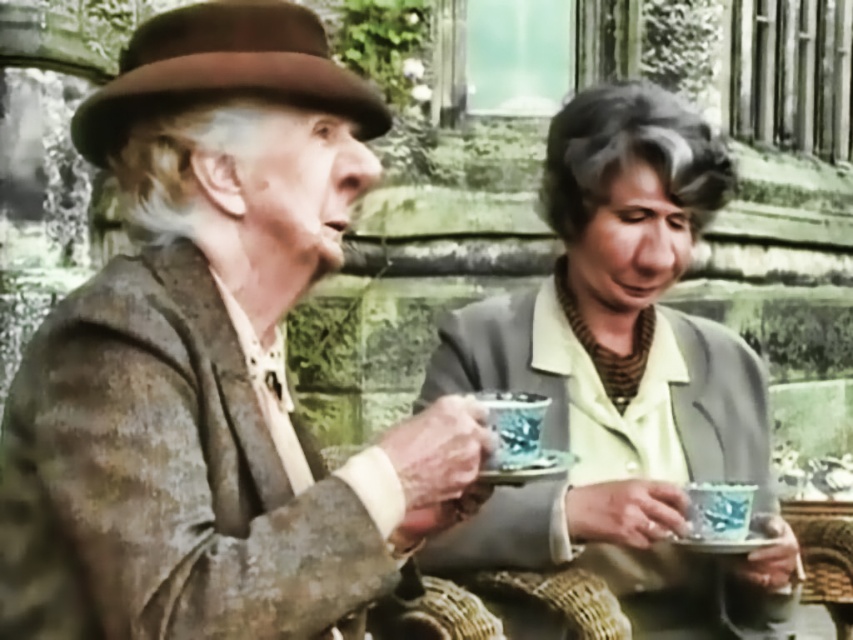
Question: Does distressed brown leather jacket at left appear on the right side of porcelain blue saucer at lower center?

Choices:
 (A) no
 (B) yes

Answer: (A)

Question: Is the position of distressed brown leather jacket at left less distant than that of matte blue teacup at center?

Choices:
 (A) no
 (B) yes

Answer: (B)

Question: Which of these objects is positioned closest to the porcelain blue saucer at lower center?

Choices:
 (A) matte blue teacup at center
 (B) distressed brown leather jacket at left

Answer: (A)

Question: Can you confirm if matte blue teacup at center is positioned below porcelain blue saucer at lower center?

Choices:
 (A) yes
 (B) no

Answer: (B)

Question: Among these points, which one is nearest to the camera?

Choices:
 (A) (42, 612)
 (B) (737, 385)
 (C) (718, 548)

Answer: (A)

Question: Which object is positioned closest to the porcelain blue saucer at lower center?

Choices:
 (A) distressed brown leather jacket at left
 (B) matte blue teacup at center

Answer: (B)